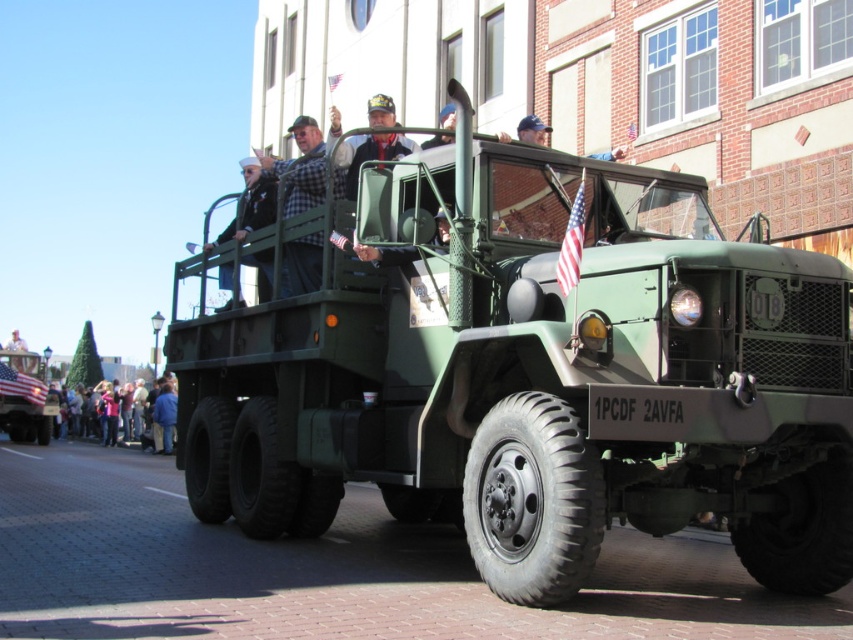
You are planning to take a photo of the dark blue uniform at center and the blue denim jacket at lower left. What is the minimum distance you need to maintain between them in your photo to ensure both are clearly visible?

The dark blue uniform at center and the blue denim jacket at lower left are 62.91 feet apart, so you need to maintain at least 62.91 feet between them in your photo to ensure both are clearly visible.

You are a photographer at the event and want to capture both the dark blue uniform at center and the blue denim jacket at lower left in a single shot. Which clothing item should you focus on first to ensure both are in frame?

The dark blue uniform at center is smaller in size compared to the blue denim jacket at lower left. To ensure both are in frame, focus on the larger blue denim jacket at lower left first, then adjust the camera to include the smaller dark blue uniform at center.